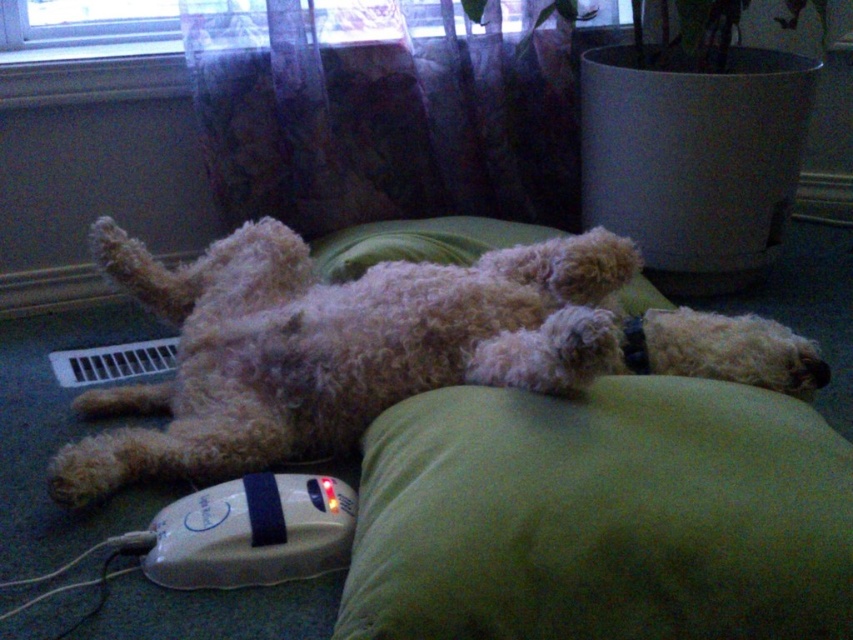
Which of these two, fuzzy beige dog at center or white plastic remote at lower left, stands taller?

fuzzy beige dog at center

Can you confirm if fuzzy beige dog at center is bigger than white plastic remote at lower left?

Correct, fuzzy beige dog at center is larger in size than white plastic remote at lower left.

Is point (791, 392) farther from viewer compared to point (337, 486)?

Yes, it is behind point (337, 486).

The height and width of the screenshot is (640, 853). What are the coordinates of `fuzzy beige dog at center` in the screenshot? It's located at (335, 346).